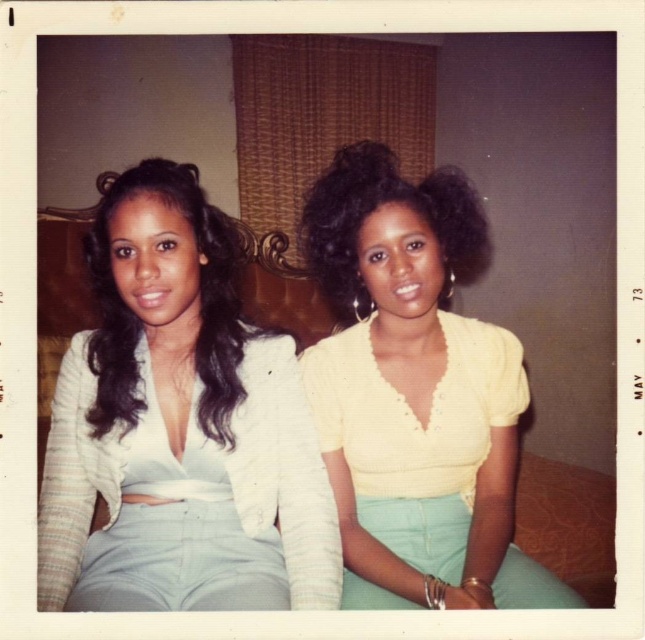
Question: Which object is farther from the camera taking this photo?

Choices:
 (A) curly black hair at center
 (B) yellow knitted top at center
 (C) white textured blouse at left

Answer: (A)

Question: Does white textured blouse at left have a smaller size compared to yellow knitted top at center?

Choices:
 (A) yes
 (B) no

Answer: (A)

Question: Which point is farther from the camera taking this photo?

Choices:
 (A) (375, 346)
 (B) (275, 512)
 (C) (94, 344)

Answer: (B)

Question: Does white textured blouse at left appear over yellow knitted top at center?

Choices:
 (A) no
 (B) yes

Answer: (B)

Question: Which object is the farthest from the yellow knitted top at center?

Choices:
 (A) curly black hair at center
 (B) white textured blouse at left

Answer: (B)

Question: Is white textured blouse at left bigger than curly black hair at center?

Choices:
 (A) no
 (B) yes

Answer: (A)